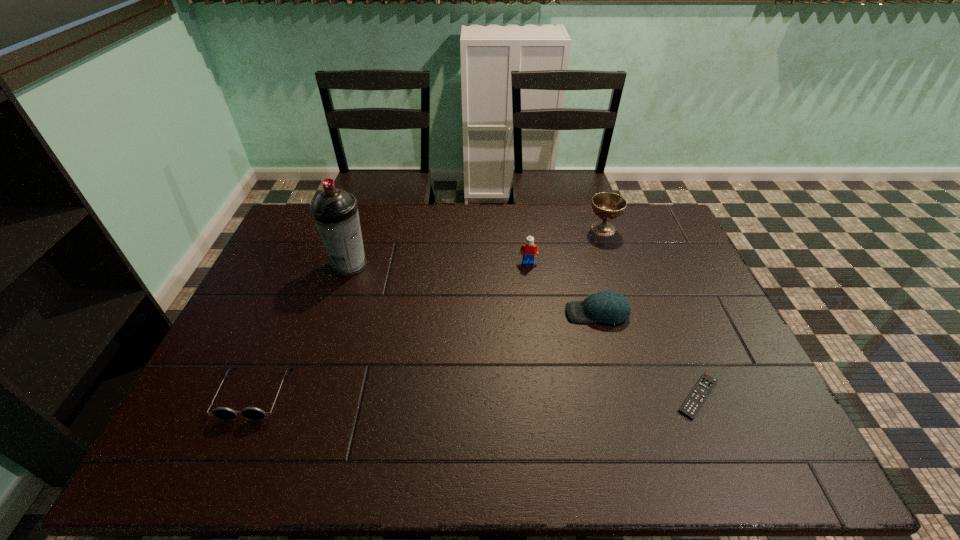
Identify the location of empty location between the fourth object from right to left and the tallest object. (439, 264).

The width and height of the screenshot is (960, 540). Find the location of `blank region between the aerosol can and the Lego`. blank region between the aerosol can and the Lego is located at coordinates (439, 264).

The image size is (960, 540). In order to click on object that is the closest to the fourth object from right to left in this screenshot , I will do `click(608, 307)`.

Find the location of a particular element. This screenshot has height=540, width=960. the third closest object to the second shortest object is located at coordinates (608, 307).

This screenshot has height=540, width=960. I want to click on vacant space that satisfies the following two spatial constraints: 1. on the front-facing side of the remote control; 2. on the right side of the fifth tallest object, so click(x=253, y=396).

The height and width of the screenshot is (540, 960). Identify the location of free point that satisfies the following two spatial constraints: 1. on the face of the shortest object; 2. on the right side of the Lego. (544, 396).

The image size is (960, 540). I want to click on vacant position in the image that satisfies the following two spatial constraints: 1. on the front side of the third nearest object; 2. on the right side of the aerosol can, so pos(334,313).

What are the coordinates of `free space that satisfies the following two spatial constraints: 1. on the front side of the shortest object; 2. on the left side of the fourth tallest object` in the screenshot? It's located at (619, 396).

The width and height of the screenshot is (960, 540). In order to click on blank space that satisfies the following two spatial constraints: 1. on the face of the shortest object; 2. on the left side of the Lego in this screenshot , I will do `click(544, 396)`.

Locate an element on the screen. This screenshot has height=540, width=960. vacant space that satisfies the following two spatial constraints: 1. on the face of the shortest object; 2. on the right side of the third object from left to right is located at coordinates (544, 396).